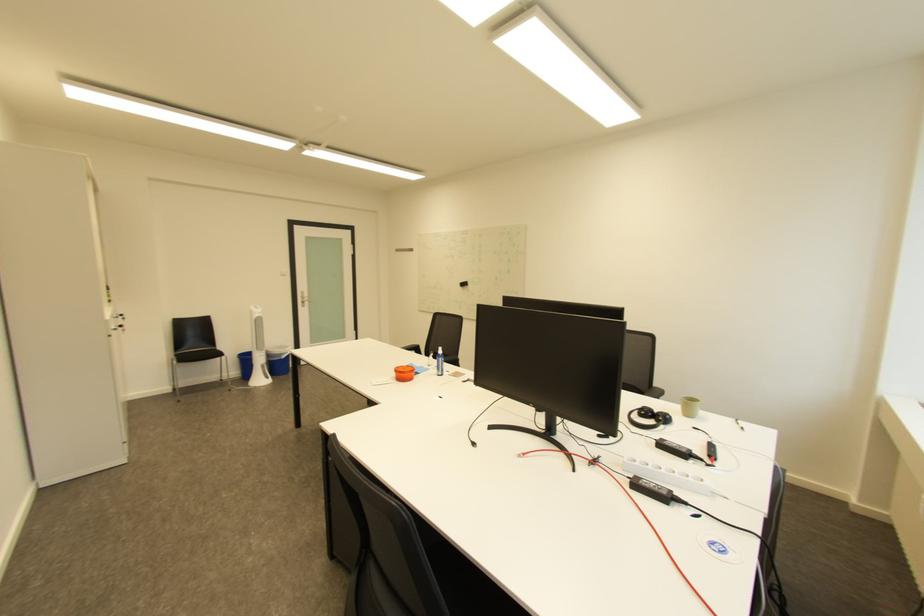
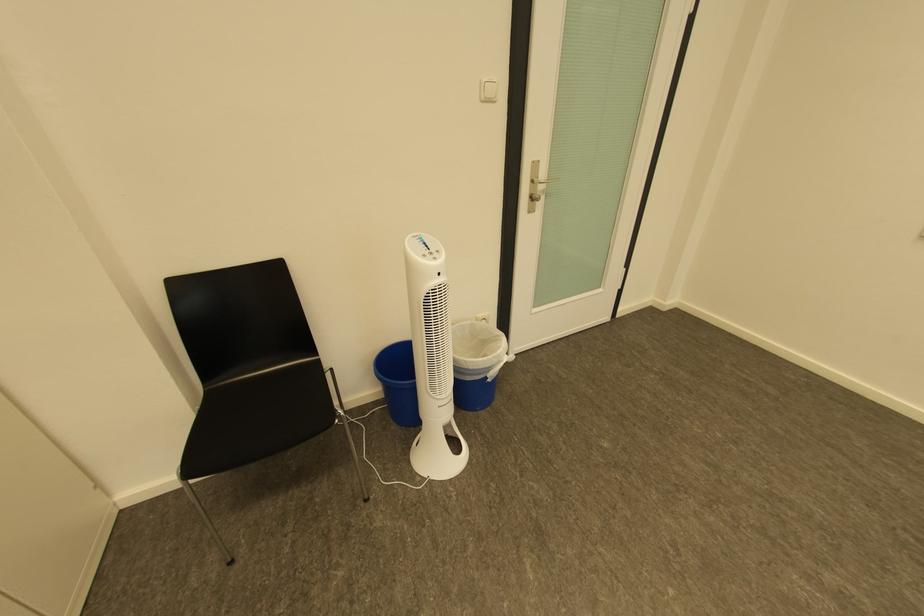
Find the pixel in the second image that matches pixel 312 298 in the first image.

(541, 182)